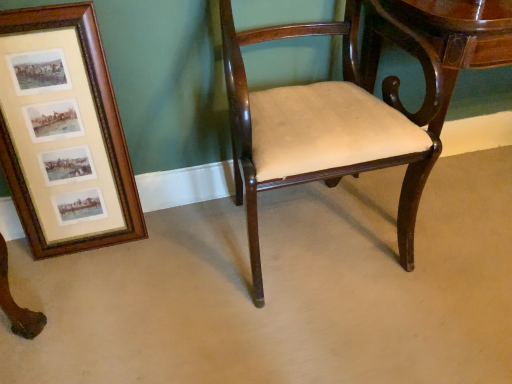
This screenshot has width=512, height=384. I want to click on vacant area situated below glossy wood table at center (from a real-world perspective), so [462, 186].